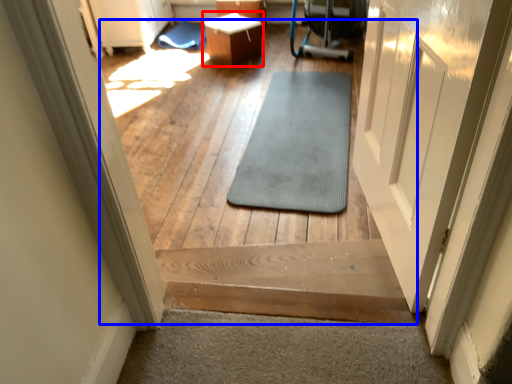
Question: Which point is closer to the camera, table (highlighted by a red box) or path (highlighted by a blue box)?

Choices:
 (A) table
 (B) path

Answer: (B)